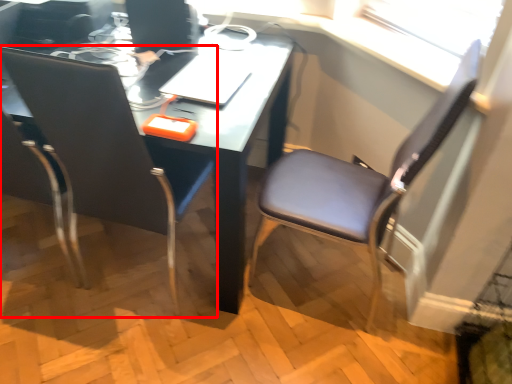
Question: Considering the relative positions of chair (annotated by the red box) and chair in the image provided, where is chair (annotated by the red box) located with respect to the staircase?

Choices:
 (A) left
 (B) right

Answer: (A)